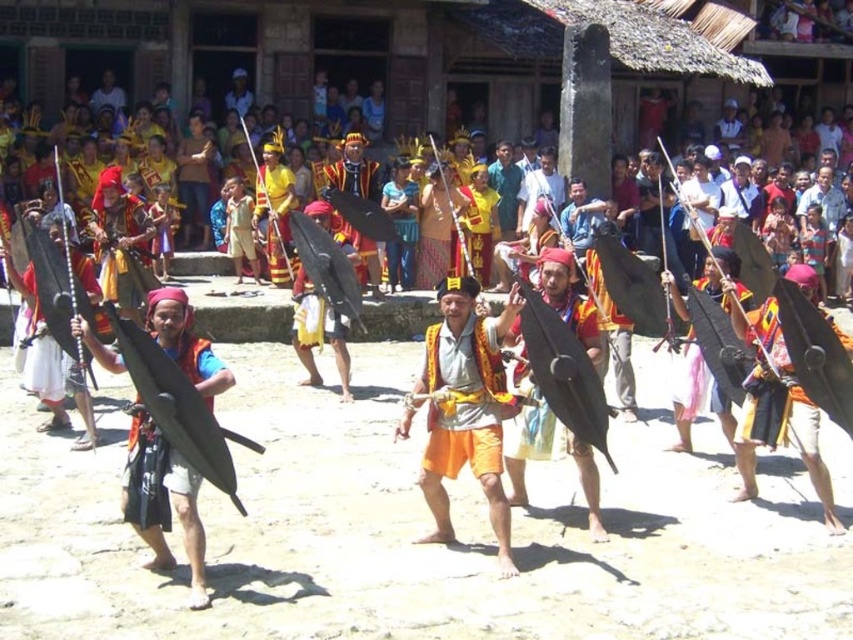
Based on the scene description, what is located at the coordinate point (466, 408)?

The orange fabric at center is located at point (466, 408).

You are a photographer at this festival and want to capture both the point at (492, 499) and the point at (515, 372) in your photo. Which point is closer to the camera?

Point at (492, 499) is in front of point at (515, 372), so it is closer to the camera.

You are a photographer trying to capture the main performer in the center. You notice the orange fabric at center and the matte black shield at center. Which object should you focus on to ensure the main performer is in the frame?

The orange fabric at center is below the matte black shield at center, so focusing on the matte black shield at center would ensure the main performer is in the frame since it is positioned higher up.